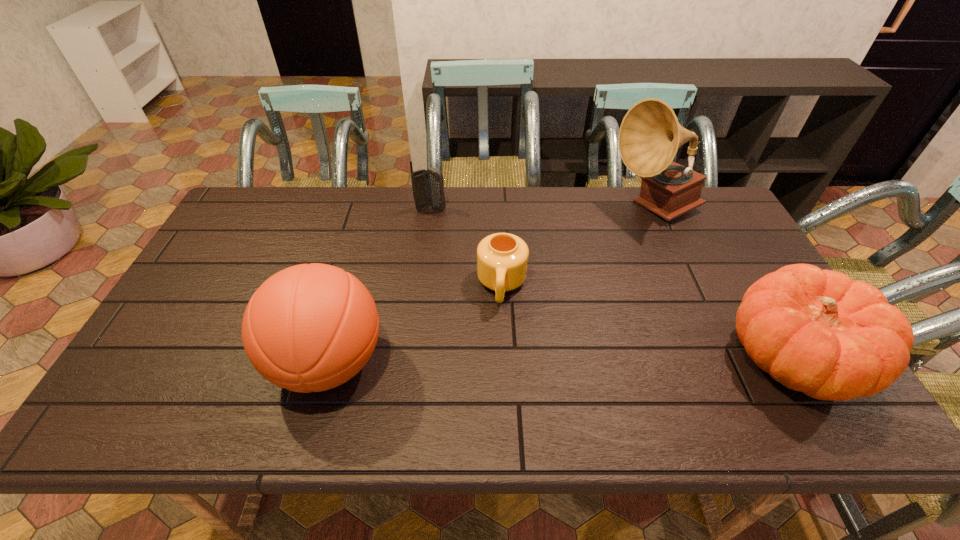
Find the location of `vacant region between the pumpkin and the third object from right to left`. vacant region between the pumpkin and the third object from right to left is located at coordinates (646, 322).

The height and width of the screenshot is (540, 960). Find the location of `object that is the second closest to the pumpkin`. object that is the second closest to the pumpkin is located at coordinates (502, 258).

This screenshot has width=960, height=540. Identify the location of object that ranks as the second closest to the second tallest object. (427, 185).

Find the location of a particular element. The width and height of the screenshot is (960, 540). vacant space that satisfies the following two spatial constraints: 1. on the back side of the phonograph record; 2. on the left side of the basketball is located at coordinates (372, 209).

Locate an element on the screen. The image size is (960, 540). vacant space that satisfies the following two spatial constraints: 1. on the back side of the tallest object; 2. on the left side of the fourth shortest object is located at coordinates (372, 209).